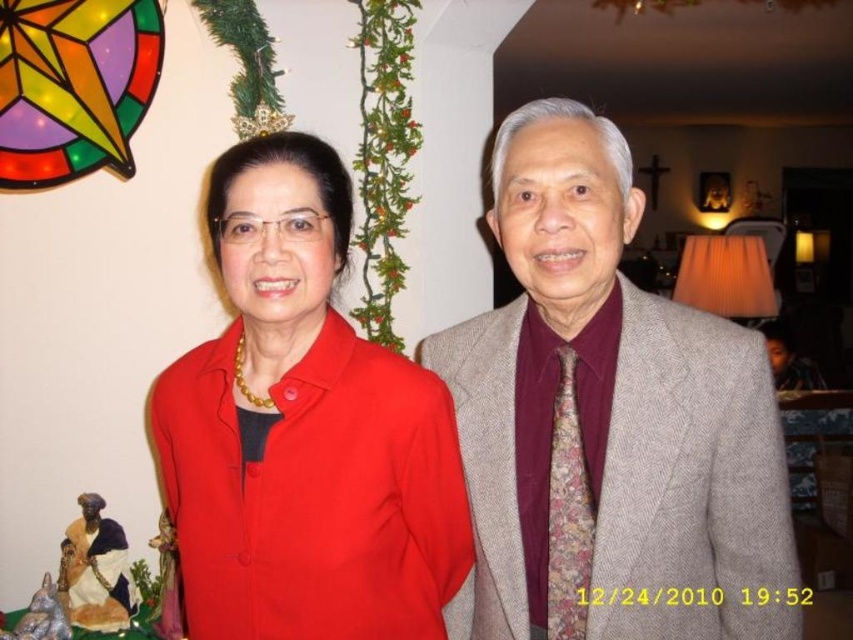
Can you confirm if gray textured suit at center is taller than matte red shirt at center?

Yes.

Locate an element on the screen. gray textured suit at center is located at coordinates (608, 422).

The width and height of the screenshot is (853, 640). What are the coordinates of `gray textured suit at center` in the screenshot? It's located at (608, 422).